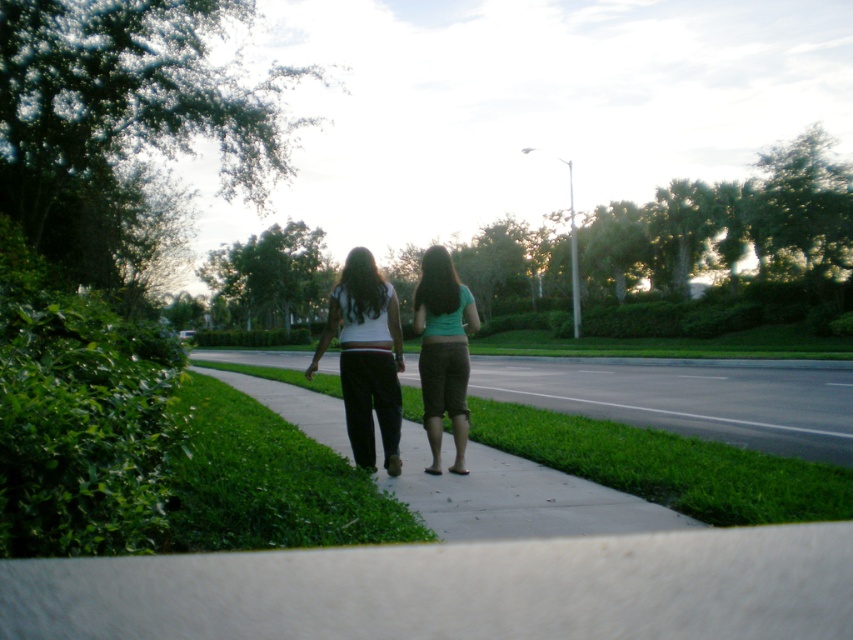
Which is below, green grass at lower left or green fabric pants at center?

Positioned lower is green grass at lower left.

Is green grass at lower left to the right of green fabric pants at center from the viewer's perspective?

In fact, green grass at lower left is to the left of green fabric pants at center.

The width and height of the screenshot is (853, 640). I want to click on green grass at lower left, so click(267, 483).

This screenshot has height=640, width=853. Identify the location of green grass at lower left. (267, 483).

Is green grass at lower left taller than white matte pants at center?

Incorrect, green grass at lower left's height is not larger of white matte pants at center's.

Based on the photo, is green grass at lower left wider than white matte pants at center?

Correct, the width of green grass at lower left exceeds that of white matte pants at center.

Is point (314, 516) closer to viewer compared to point (364, 252)?

Yes, point (314, 516) is in front of point (364, 252).

Locate an element on the screen. green grass at lower left is located at coordinates (267, 483).

Is point (838, 461) farther from viewer compared to point (252, 445)?

No, it is not.

Image resolution: width=853 pixels, height=640 pixels. I want to click on smooth concrete sidewalk at center, so click(x=689, y=397).